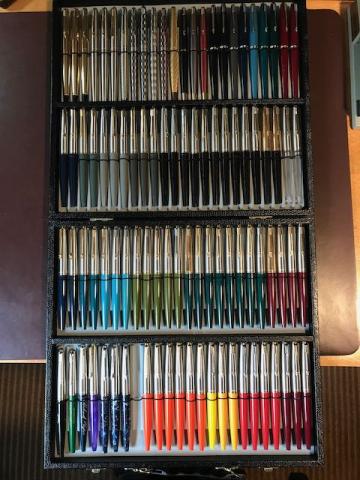
This screenshot has height=480, width=360. What are the coordinates of `orange pen` in the screenshot? It's located at (179, 418), (159, 417).